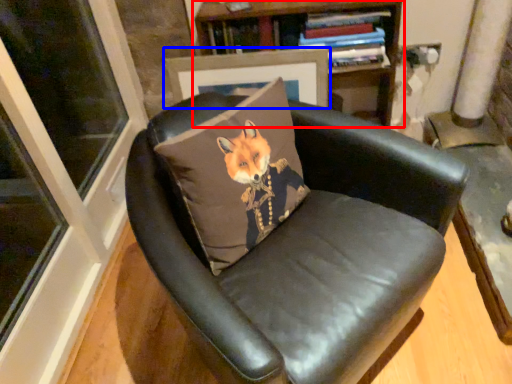
Question: Which point is further to the camera, bookcase (highlighted by a red box) or picture frame (highlighted by a blue box)?

Choices:
 (A) bookcase
 (B) picture frame

Answer: (B)